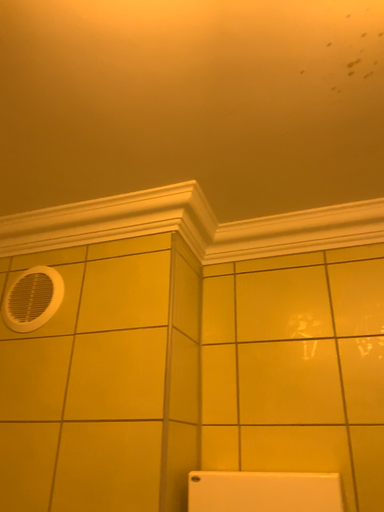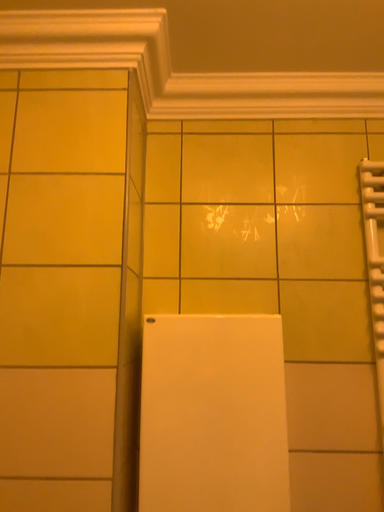
Question: How did the camera likely rotate when shooting the video?

Choices:
 (A) rotated downward
 (B) rotated upward

Answer: (A)